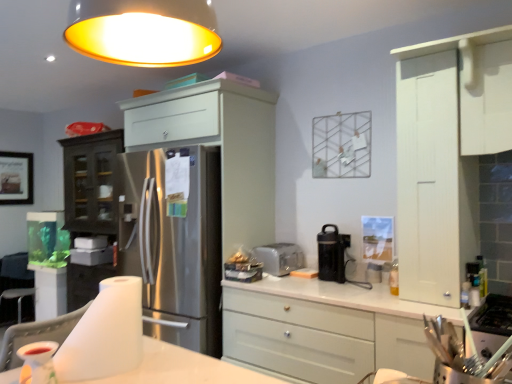
Question: Which direction should I rotate to look at satin white cabinet at center, which ranks as the 1th cabinetry in left-to-right order?

Choices:
 (A) left
 (B) right

Answer: (A)

Question: Is white glossy table at lower center next to wooden framed picture at left?

Choices:
 (A) yes
 (B) no

Answer: (B)

Question: Is white glossy table at lower center not inside wooden framed picture at left?

Choices:
 (A) no
 (B) yes

Answer: (B)

Question: Can you confirm if white glossy table at lower center is positioned to the left of wooden framed picture at left?

Choices:
 (A) no
 (B) yes

Answer: (A)

Question: From a real-world perspective, is white glossy table at lower center below wooden framed picture at left?

Choices:
 (A) no
 (B) yes

Answer: (B)

Question: From the image's perspective, is white glossy table at lower center under wooden framed picture at left?

Choices:
 (A) yes
 (B) no

Answer: (A)

Question: Is white glossy table at lower center facing away from wooden framed picture at left?

Choices:
 (A) yes
 (B) no

Answer: (B)

Question: Is satin white cabinet at center, which ranks as the 1th cabinetry in left-to-right order, at the left side of translucent plastic cup at lower left?

Choices:
 (A) yes
 (B) no

Answer: (B)

Question: From the image's perspective, would you say satin white cabinet at center, which ranks as the 1th cabinetry in left-to-right order, is shown under translucent plastic cup at lower left?

Choices:
 (A) yes
 (B) no

Answer: (B)

Question: From the image's perspective, is satin white cabinet at center, placed as the 3th cabinetry when sorted from right to left, located above translucent plastic cup at lower left?

Choices:
 (A) no
 (B) yes

Answer: (B)

Question: Can you see satin white cabinet at center, placed as the 3th cabinetry when sorted from right to left, touching translucent plastic cup at lower left?

Choices:
 (A) no
 (B) yes

Answer: (A)

Question: Considering the relative sizes of satin white cabinet at center, placed as the 3th cabinetry when sorted from right to left, and translucent plastic cup at lower left in the image provided, is satin white cabinet at center, placed as the 3th cabinetry when sorted from right to left, wider than translucent plastic cup at lower left?

Choices:
 (A) no
 (B) yes

Answer: (B)

Question: From a real-world perspective, is satin white cabinet at center, which ranks as the 1th cabinetry in left-to-right order, located higher than translucent plastic cup at lower left?

Choices:
 (A) no
 (B) yes

Answer: (B)

Question: From the image's perspective, does white fabric chair at lower left appear lower than white matte cabinet at center, arranged as the 2th cabinetry when viewed from the left?

Choices:
 (A) no
 (B) yes

Answer: (A)